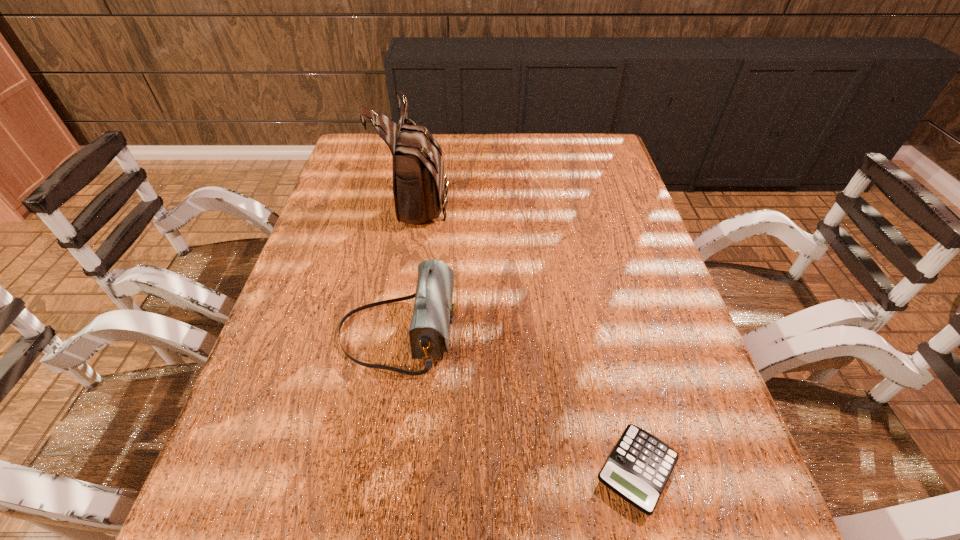
This screenshot has width=960, height=540. In order to click on free space that satisfies the following two spatial constraints: 1. on the front-facing side of the taller shoulder bag; 2. on the left side of the shortest object in this screenshot , I will do `click(374, 470)`.

The width and height of the screenshot is (960, 540). In order to click on free spot that satisfies the following two spatial constraints: 1. on the front-facing side of the nearer shoulder bag; 2. on the right side of the tallest object in this screenshot , I will do `click(397, 333)`.

The width and height of the screenshot is (960, 540). In order to click on free spot that satisfies the following two spatial constraints: 1. on the front-facing side of the farthest object; 2. on the back side of the second tallest object in this screenshot , I will do `click(397, 333)`.

This screenshot has width=960, height=540. In order to click on blank area in the image that satisfies the following two spatial constraints: 1. on the front-facing side of the taller shoulder bag; 2. on the right side of the shortest object in this screenshot , I will do `click(374, 470)`.

Find the location of a particular element. Image resolution: width=960 pixels, height=540 pixels. free spot that satisfies the following two spatial constraints: 1. on the front-facing side of the rightmost object; 2. on the left side of the tallest object is located at coordinates (374, 470).

At what (x,y) coordinates should I click in order to perform the action: click on vacant area that satisfies the following two spatial constraints: 1. on the front-facing side of the nearest object; 2. on the right side of the tallest object. Please return your answer as a coordinate pair (x, y). The height and width of the screenshot is (540, 960). Looking at the image, I should click on [374, 470].

Locate an element on the screen. Image resolution: width=960 pixels, height=540 pixels. vacant space that satisfies the following two spatial constraints: 1. on the front-facing side of the second tallest object; 2. on the right side of the farthest object is located at coordinates click(x=397, y=333).

I want to click on free space that satisfies the following two spatial constraints: 1. on the front side of the nearer shoulder bag; 2. on the right side of the rightmost object, so click(376, 470).

Where is `vacant region that satisfies the following two spatial constraints: 1. on the front-facing side of the shortest object; 2. on the left side of the farthest object`? The height and width of the screenshot is (540, 960). vacant region that satisfies the following two spatial constraints: 1. on the front-facing side of the shortest object; 2. on the left side of the farthest object is located at coordinates (374, 470).